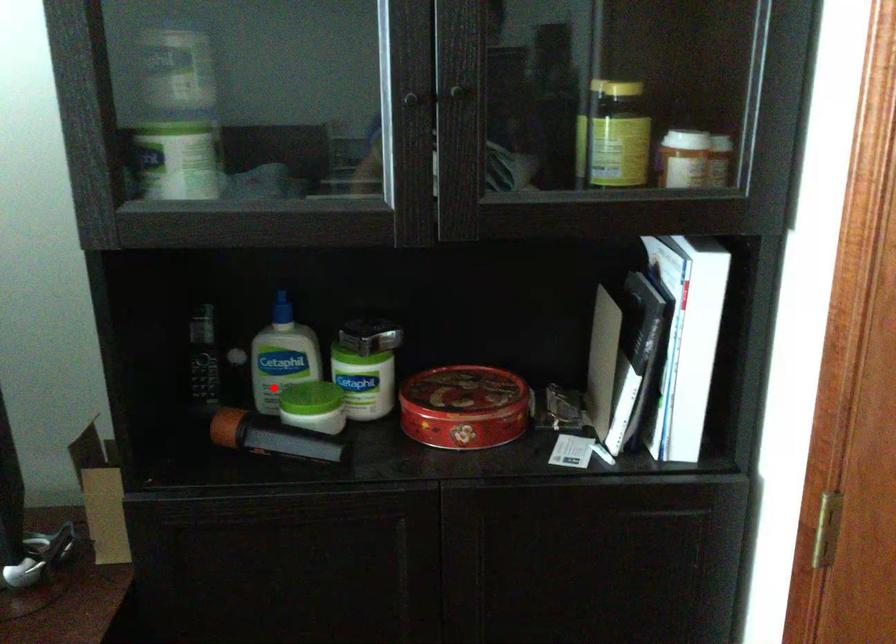
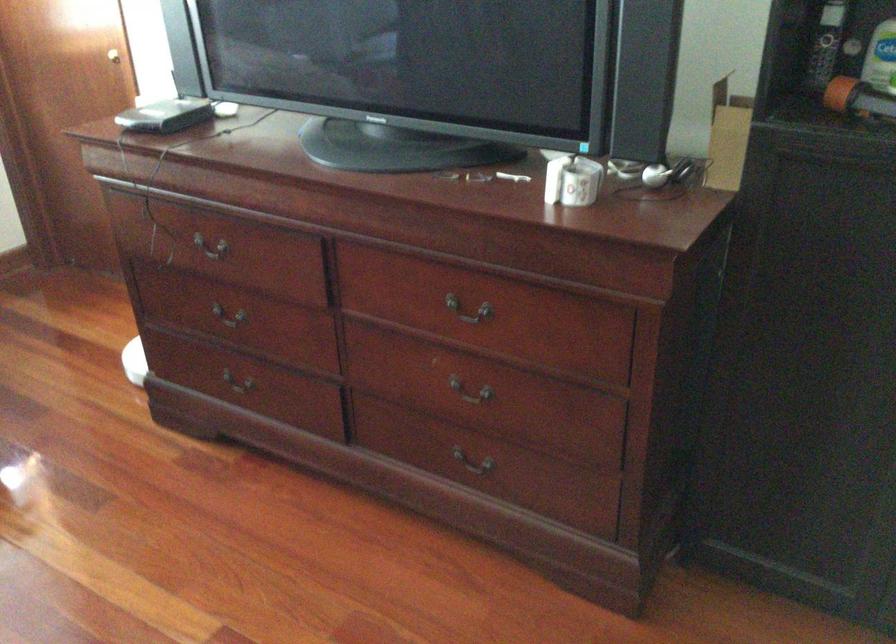
Question: I am providing you with two images of the same scene from different viewpoints. Image1 has a red point marked. In image2, the corresponding 3D location appears at what relative position? Reply with the corresponding letter.

Choices:
 (A) Closer
 (B) Farther

Answer: (B)